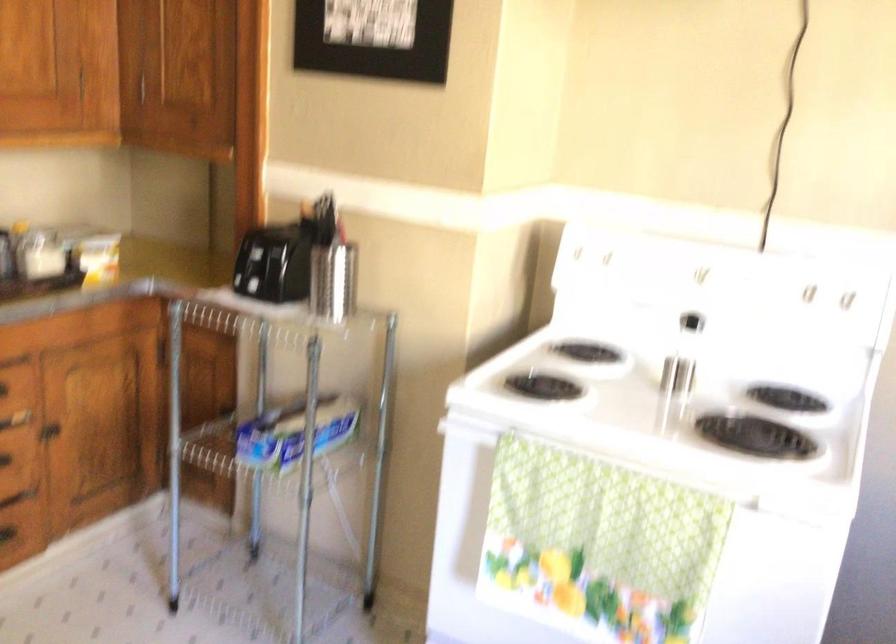
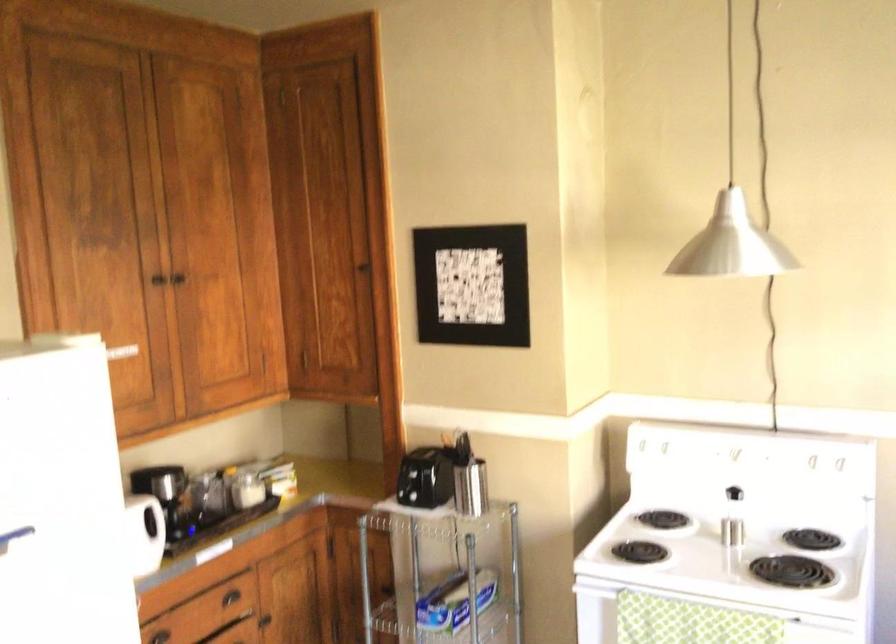
Question: What movement of the cameraman would produce the second image?

Choices:
 (A) Left
 (B) Right
 (C) Forward
 (D) Backward

Answer: (D)